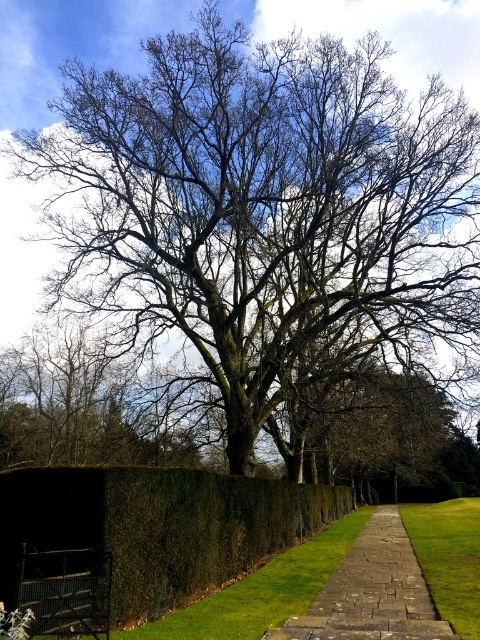
Which is below, green leafy hedge at lower left or green grass at center?

green grass at center is below.

Can you confirm if green leafy hedge at lower left is positioned below green grass at center?

No, green leafy hedge at lower left is not below green grass at center.

Find the location of a particular element. green leafy hedge at lower left is located at coordinates (157, 525).

Is green leafy hedge at lower left wider than brown stone path at center?

No.

Where is `green leafy hedge at lower left`? This screenshot has height=640, width=480. green leafy hedge at lower left is located at coordinates (157, 525).

Between point (203, 536) and point (388, 618), which one is positioned in front?

Point (388, 618)

You are a GUI agent. You are given a task and a screenshot of the screen. Output one action in this format:
    pyautogui.click(x=<x>, y=<y>)
    Task: Click on the green leafy hedge at lower left
    This screenshot has width=480, height=640.
    Given the screenshot: What is the action you would take?
    pyautogui.click(x=157, y=525)

The height and width of the screenshot is (640, 480). What do you see at coordinates (372, 592) in the screenshot? I see `brown stone path at center` at bounding box center [372, 592].

Between point (417, 564) and point (429, 538), which one is positioned behind?

Positioned behind is point (429, 538).

Does point (387, 616) come farther from viewer compared to point (458, 566)?

That is False.

You are a GUI agent. You are given a task and a screenshot of the screen. Output one action in this format:
    pyautogui.click(x=<x>, y=<y>)
    Task: Click on the brown stone path at center
    The width and height of the screenshot is (480, 640).
    Given the screenshot: What is the action you would take?
    pyautogui.click(x=372, y=592)